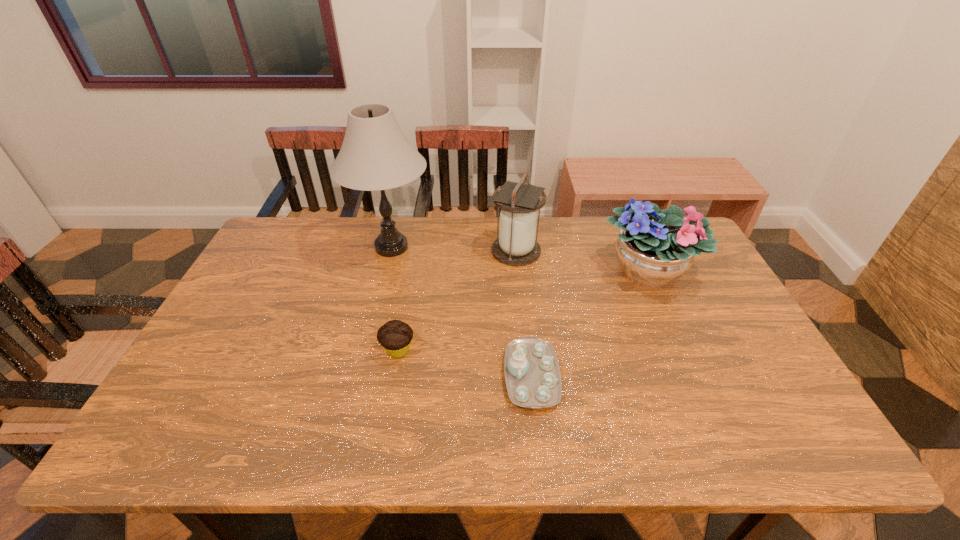
The image size is (960, 540). In order to click on vacant space in between the chinaware and the rightmost object in this screenshot , I will do `click(590, 324)`.

The height and width of the screenshot is (540, 960). In order to click on empty space between the lantern and the rightmost object in this screenshot , I will do `click(583, 261)`.

The image size is (960, 540). In order to click on vacant area between the tallest object and the muffin in this screenshot , I will do `click(395, 299)`.

This screenshot has height=540, width=960. Find the location of `free space between the tallest object and the lantern`. free space between the tallest object and the lantern is located at coordinates (454, 249).

You are a GUI agent. You are given a task and a screenshot of the screen. Output one action in this format:
    pyautogui.click(x=<x>, y=<y>)
    Task: Click on the free space that is in between the chinaware and the lamp
    This screenshot has height=540, width=960.
    Given the screenshot: What is the action you would take?
    pyautogui.click(x=462, y=312)

At what (x,y) coordinates should I click in order to perform the action: click on free spot between the muffin and the tallest object. Please return your answer as a coordinate pair (x, y). Image resolution: width=960 pixels, height=540 pixels. Looking at the image, I should click on (395, 299).

Find the location of a particular element. The image size is (960, 540). free space between the muffin and the bouquet is located at coordinates (523, 311).

I want to click on free spot between the tallest object and the lantern, so click(x=454, y=249).

I want to click on object that is the third closest to the bouquet, so click(375, 155).

This screenshot has width=960, height=540. What are the coordinates of `the closest object to the tallest object` in the screenshot? It's located at (519, 202).